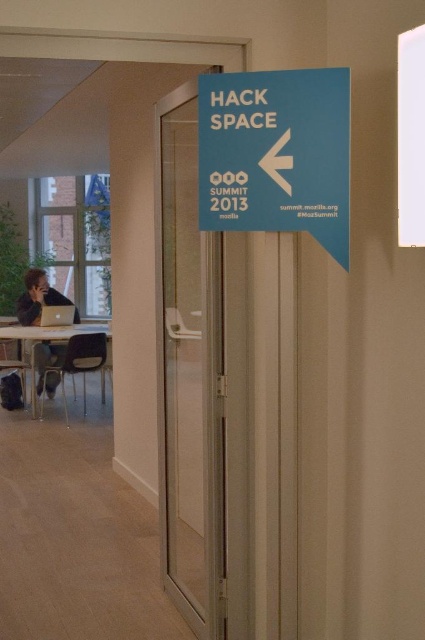
Which is in front, point (178, 556) or point (70, 333)?

Positioned in front is point (178, 556).

At what (x,y) coordinates should I click in order to perform the action: click on transparent glass door at center. Please return your answer as a coordinate pair (x, y). This screenshot has width=425, height=640. Looking at the image, I should click on (189, 385).

Find the location of `transparent glass door at center`. transparent glass door at center is located at coordinates (189, 385).

Is the position of blue matte sign at center more distant than that of dark blue shirt at lower left?

No.

Can you confirm if blue matte sign at center is taller than dark blue shirt at lower left?

Yes.

Locate an element on the screen. The height and width of the screenshot is (640, 425). blue matte sign at center is located at coordinates (275, 154).

You are a GUI agent. You are given a task and a screenshot of the screen. Output one action in this format:
    pyautogui.click(x=<x>, y=<y>)
    Task: Click on the blue matte sign at center
    
    Given the screenshot: What is the action you would take?
    pyautogui.click(x=275, y=154)

Is blue matte sign at center above silver metallic laptop at left?

Indeed, blue matte sign at center is positioned over silver metallic laptop at left.

The height and width of the screenshot is (640, 425). What do you see at coordinates (275, 154) in the screenshot?
I see `blue matte sign at center` at bounding box center [275, 154].

Locate an element on the screen. Image resolution: width=425 pixels, height=640 pixels. blue matte sign at center is located at coordinates (275, 154).